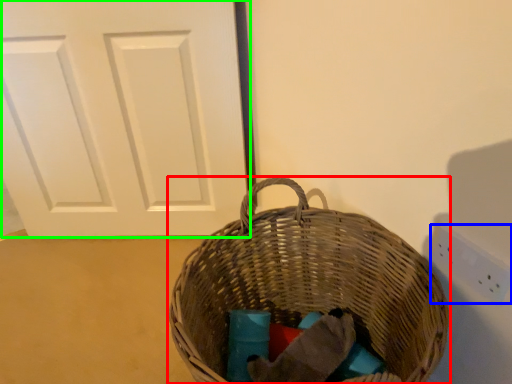
Question: Based on their relative distances, which object is nearer to picnic basket (highlighted by a red box)? Choose from electric outlet (highlighted by a blue box) and door (highlighted by a green box).

Choices:
 (A) electric outlet
 (B) door

Answer: (A)